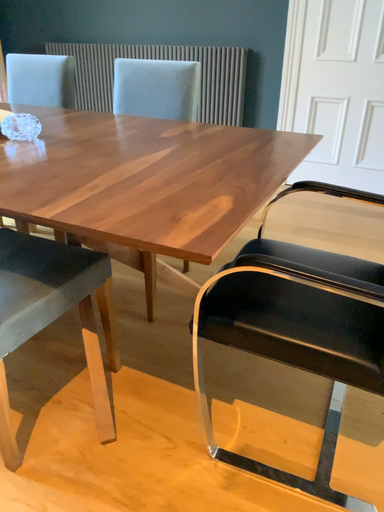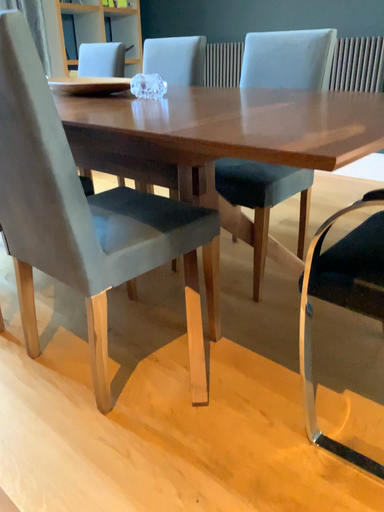
Question: Which way did the camera rotate in the video?

Choices:
 (A) rotated right
 (B) rotated left

Answer: (B)